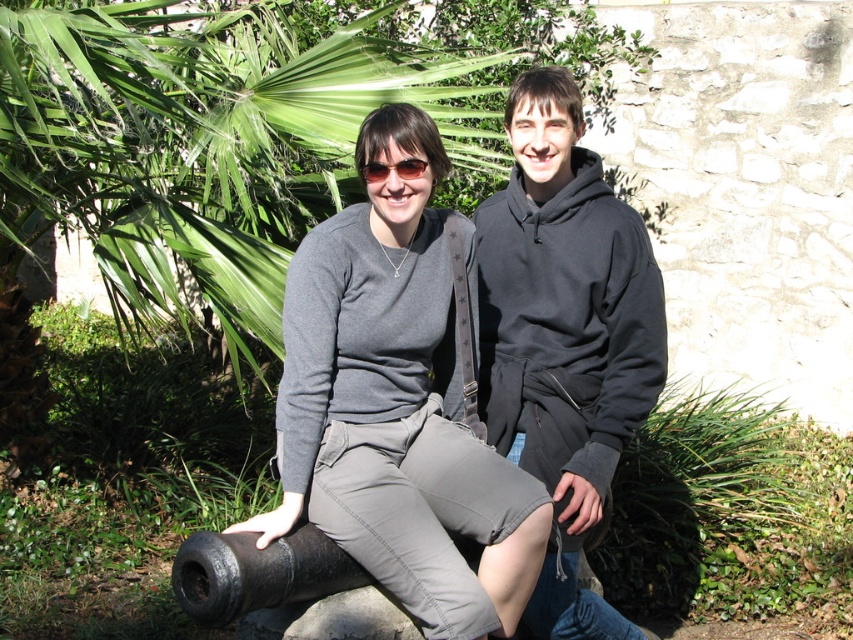
Does black fleece sweatshirt at center appear under black matte cannon at lower left?

No.

Is point (479, 220) behind point (308, 573)?

Yes.

Is point (553, 625) positioned behind point (312, 588)?

Yes, it is behind point (312, 588).

At what (x,y) coordinates should I click in order to perform the action: click on black fleece sweatshirt at center. Please return your answer as a coordinate pair (x, y). The height and width of the screenshot is (640, 853). Looking at the image, I should click on (564, 333).

This screenshot has width=853, height=640. What do you see at coordinates (199, 147) in the screenshot?
I see `green leafy palm tree at upper left` at bounding box center [199, 147].

Measure the distance from green leafy palm tree at upper left to matte gray sweatshirt at center.

Answer: 4.76 feet

Is point (73, 172) positioned after point (308, 433)?

Yes, point (73, 172) is farther from viewer.

Locate an element on the screen. Image resolution: width=853 pixels, height=640 pixels. green leafy palm tree at upper left is located at coordinates (199, 147).

Between black fleece sweatshirt at center and matte gray sweatshirt at center, which one has less height?

With less height is matte gray sweatshirt at center.

Who is more distant from viewer, (634, 243) or (395, 360)?

Positioned behind is point (634, 243).

Who is more forward, (x=625, y=628) or (x=399, y=307)?

Point (x=399, y=307) is more forward.

Where is `black fleece sweatshirt at center`? This screenshot has height=640, width=853. black fleece sweatshirt at center is located at coordinates 564,333.